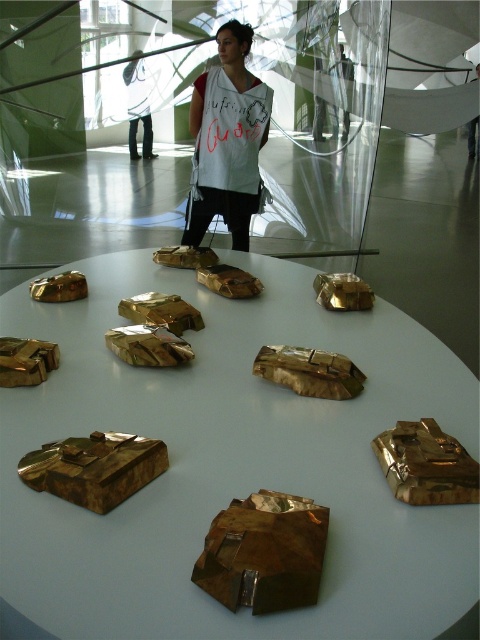
You are an art critic attending an exhibition and notice the gold metallic sculpture at center and the matte white shirt at center. Based on their positions, which object is closer to you?

The gold metallic sculpture at center is closer to you since it is in front of the matte white shirt at center.

You are an art curator standing at the entrance of the gallery. You need to place a new sculpture exactly at the center of the room. The gold metallic sculpture at center is currently occupying the central point. Can you determine if the new sculpture can be placed there without moving the existing one?

The gold metallic sculpture at center is already located at the central point of the room, so you cannot place the new sculpture there without moving the existing one.